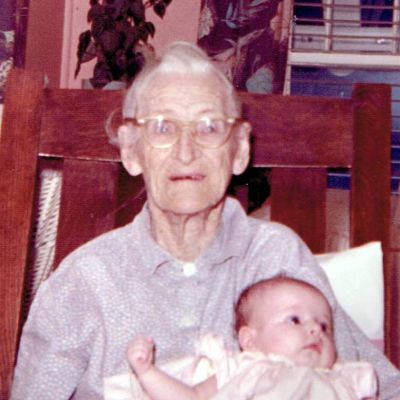
Where is `chair`? This screenshot has height=400, width=400. chair is located at coordinates (87, 132), (300, 133).